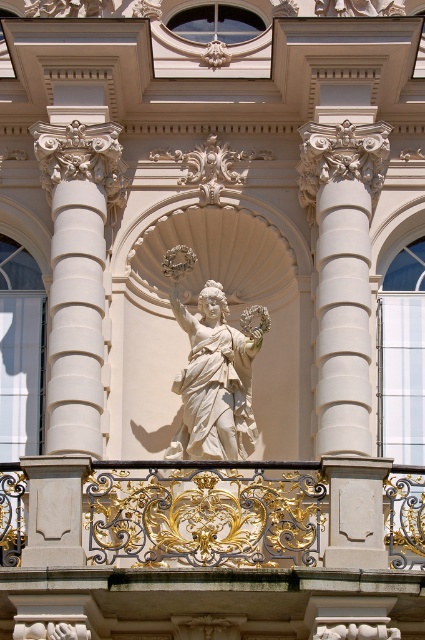
Which is behind, point (147, 480) or point (186, 321)?

Positioned behind is point (186, 321).

Does gold wrought iron at center have a smaller size compared to white marble statue at center?

Yes, gold wrought iron at center is smaller than white marble statue at center.

This screenshot has width=425, height=640. Describe the element at coordinates (204, 513) in the screenshot. I see `gold wrought iron at center` at that location.

The width and height of the screenshot is (425, 640). I want to click on gold wrought iron at center, so click(x=204, y=513).